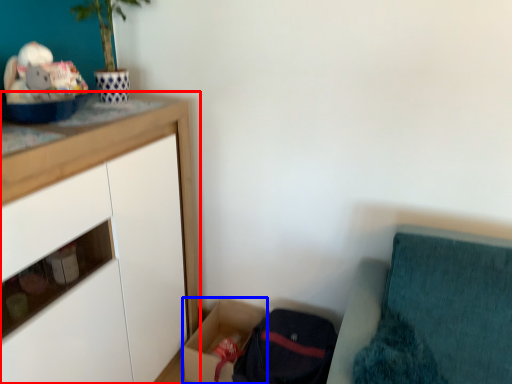
Question: Which object appears farthest to the camera in this image, cabinetry (highlighted by a red box) or storage box (highlighted by a blue box)?

Choices:
 (A) cabinetry
 (B) storage box

Answer: (B)